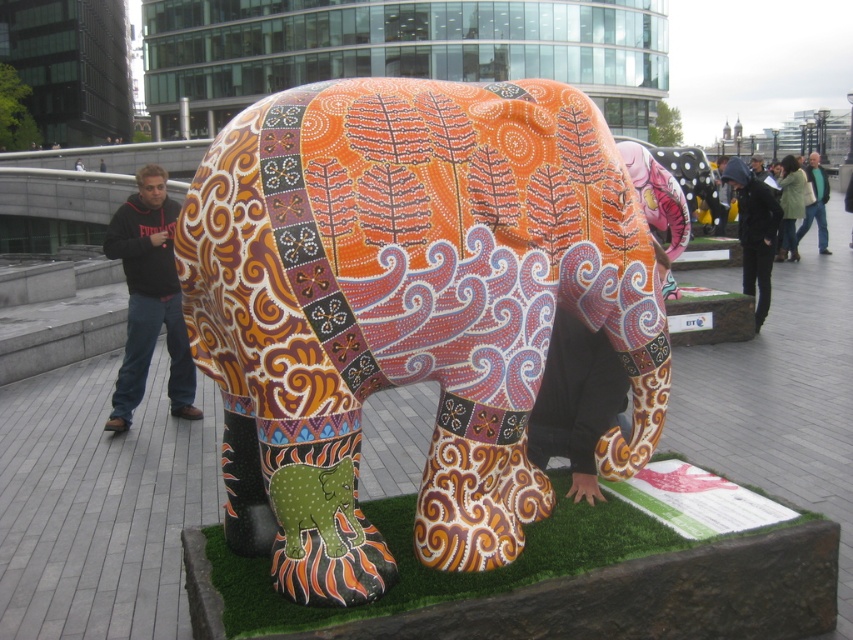
You are standing in front of the elephant sculpture and want to take a photo. You notice two points marked on the ground at coordinates point (659,225) and point (810,205). Which point should you stand at to be closer to the sculpture?

You should stand at point (659,225) because it is in front of point (810,205), making it closer to the sculpture.

You are an artist planning to install a new sculpture in the same area as the elephant sculpture. You need to know which object is shorter between the green artificial turf at center and the black fabric jacket at upper right to determine placement. Can you tell me which one is shorter?

The green artificial turf at center is shorter than the black fabric jacket at upper right because it is not as tall as the jacket.

You are standing in front of the sculpture and need to locate the painted ceramic elephant at center. What are the coordinates of its position?

The painted ceramic elephant at center is located at coordinates point (405,308).